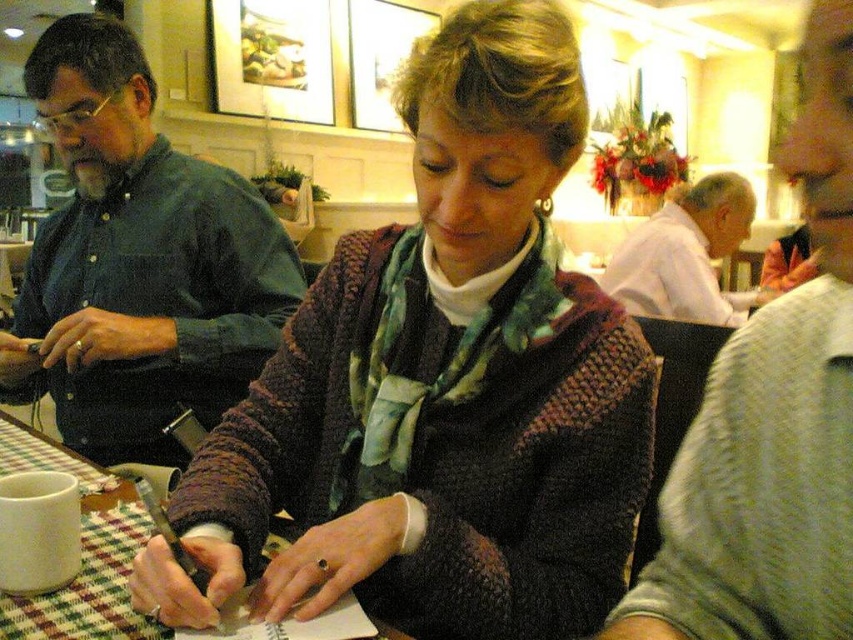
Question: Which point appears closest to the camera in this image?

Choices:
 (A) (469, 449)
 (B) (120, 346)
 (C) (102, 573)
 (D) (846, 522)

Answer: (D)

Question: Does checkered fabric table at center have a larger size compared to white cotton shirt at upper right?

Choices:
 (A) no
 (B) yes

Answer: (A)

Question: Estimate the real-world distances between objects in this image. Which object is farther from the knitted sweater at center?

Choices:
 (A) white cotton shirt at upper right
 (B) green matte shirt at left
 (C) light pink shirt at center

Answer: (A)

Question: From the image, what is the correct spatial relationship of knitted sweater at center in relation to white cotton shirt at upper right?

Choices:
 (A) below
 (B) above

Answer: (A)

Question: Can you confirm if light pink shirt at center is thinner than checkered fabric table at center?

Choices:
 (A) no
 (B) yes

Answer: (B)

Question: Estimate the real-world distances between objects in this image. Which object is closer to the green matte shirt at left?

Choices:
 (A) white cotton shirt at upper right
 (B) light pink shirt at center
 (C) checkered fabric table at center
 (D) knitted sweater at center

Answer: (C)